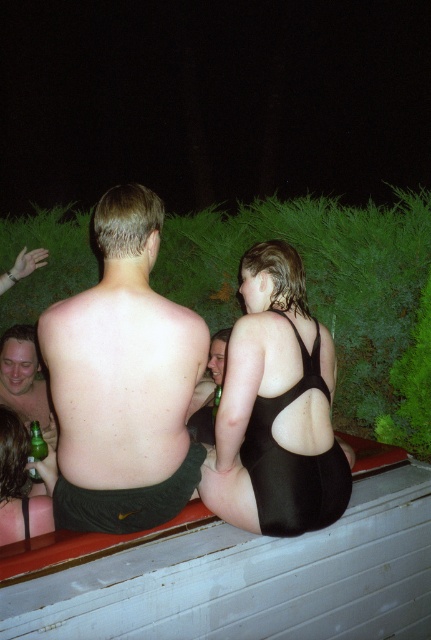
Between skinny white man at center and green glass bottle at lower left, which one is positioned higher?

skinny white man at center is higher up.

Locate an element on the screen. skinny white man at center is located at coordinates (122, 381).

Can you confirm if black matte bikini top at center is positioned to the left of shiny metallic beer bottle at lower left?

In fact, black matte bikini top at center is to the right of shiny metallic beer bottle at lower left.

Who is shorter, black matte bikini top at center or shiny metallic beer bottle at lower left?

shiny metallic beer bottle at lower left

What do you see at coordinates (277, 408) in the screenshot?
I see `black matte bikini top at center` at bounding box center [277, 408].

What are the coordinates of `black matte bikini top at center` in the screenshot? It's located at (277, 408).

Between white painted wood at lower center and skinny white man at center, which one appears on the left side from the viewer's perspective?

skinny white man at center is more to the left.

The height and width of the screenshot is (640, 431). Identify the location of white painted wood at lower center. (250, 579).